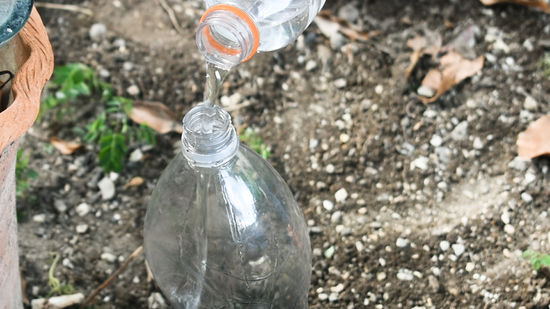
In order to click on brick wall in this screenshot , I will do point(2,214).